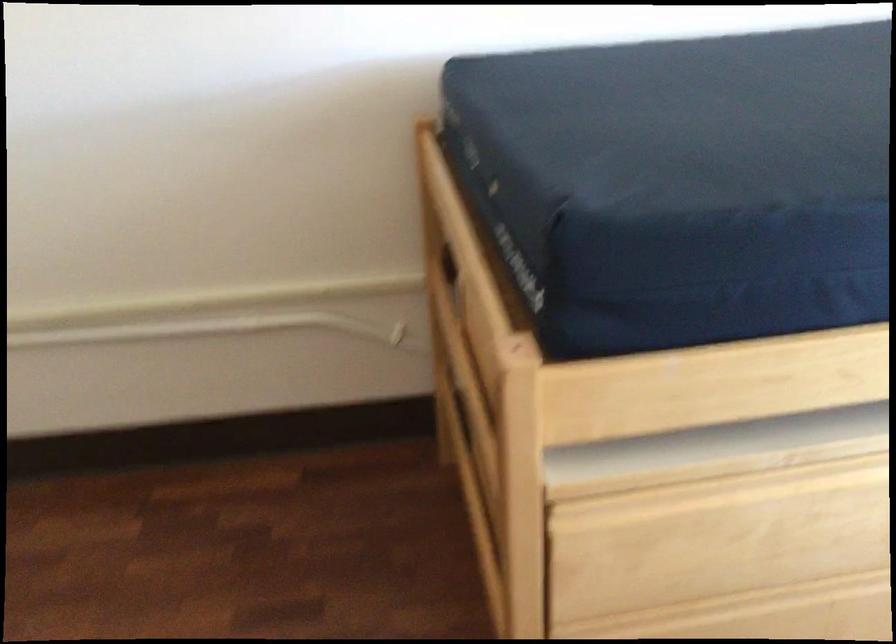
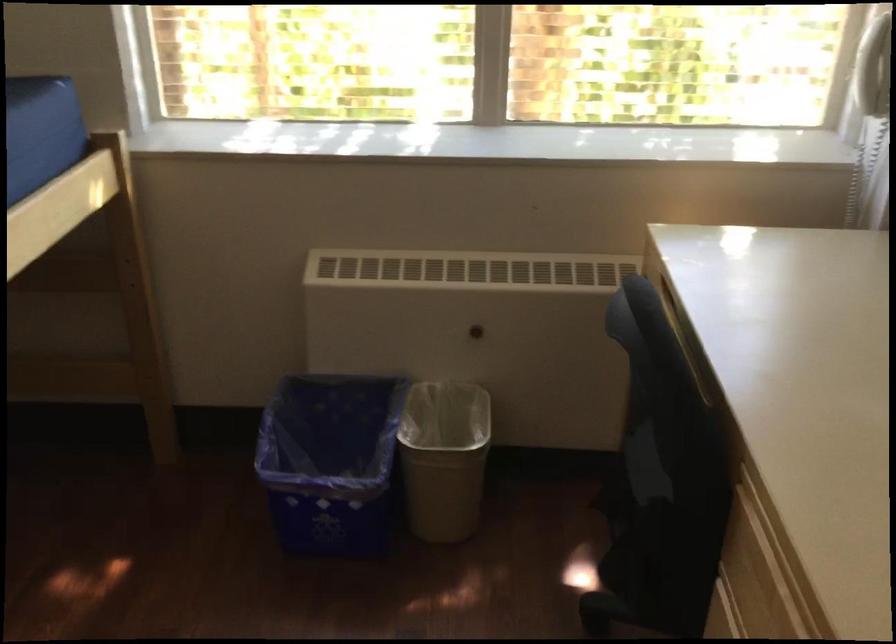
How did the camera likely rotate?

The camera's rotation is toward right-down.